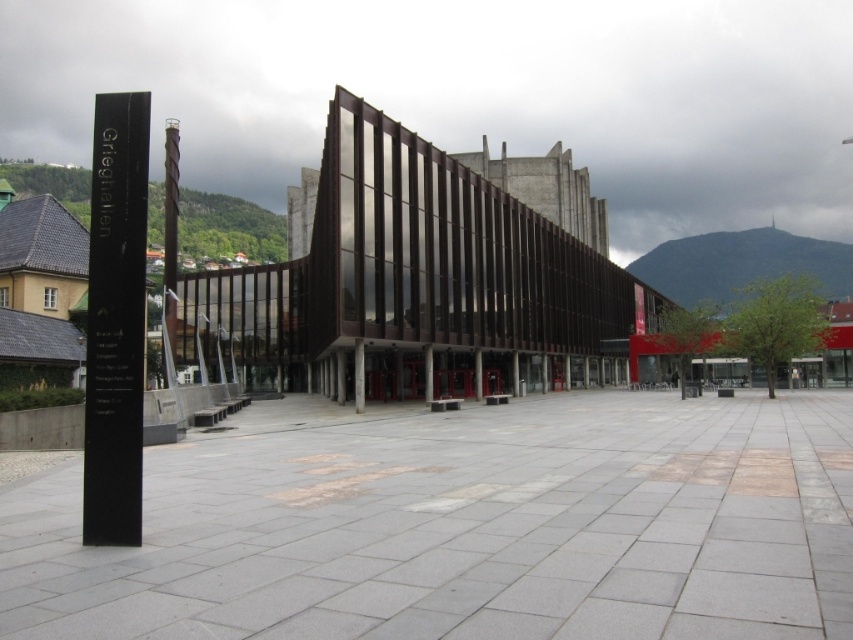
Which is behind, point (119, 180) or point (165, 314)?

The point (165, 314) is behind.

Between black polished stone pole at left and dark brown polished wood pole at left, which one has more height?

dark brown polished wood pole at left

Between point (135, 266) and point (165, 276), which one is positioned behind?

Positioned behind is point (165, 276).

Image resolution: width=853 pixels, height=640 pixels. In order to click on black polished stone pole at left in this screenshot , I will do (115, 321).